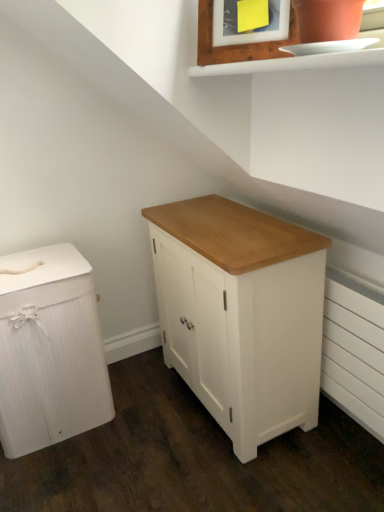
Find the location of a particular element. vacant space to the left of white painted radiator at lower right is located at coordinates (299, 459).